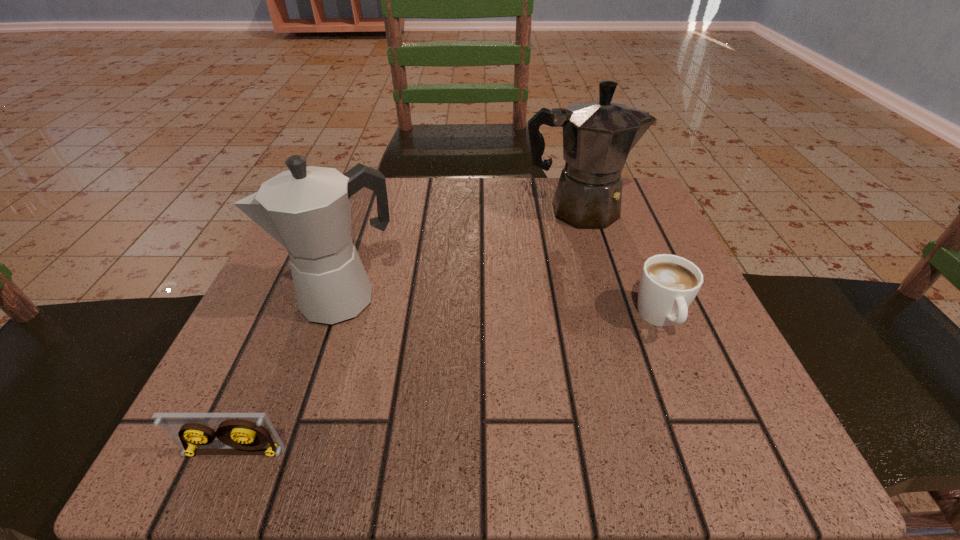
Where is `the farther coffeepot`? The width and height of the screenshot is (960, 540). the farther coffeepot is located at coordinates (597, 135).

At what (x,y) coordinates should I click in order to perform the action: click on the right coffeepot. Please return your answer as a coordinate pair (x, y). The height and width of the screenshot is (540, 960). Looking at the image, I should click on (597, 135).

Locate an element on the screen. The height and width of the screenshot is (540, 960). the left coffeepot is located at coordinates (307, 210).

Find the location of a particular element. cappuccino is located at coordinates (668, 285).

Identify the location of videotape. The width and height of the screenshot is (960, 540). (239, 433).

Locate an element on the screen. The width and height of the screenshot is (960, 540). free location located 0.300m on the right of the left coffeepot is located at coordinates tap(576, 300).

Locate an element on the screen. free location located 0.140m with the handle on the side of the cappuccino is located at coordinates (707, 430).

This screenshot has height=540, width=960. What are the coordinates of `object present at the far edge` in the screenshot? It's located at (597, 135).

The height and width of the screenshot is (540, 960). What are the coordinates of `object situated at the near edge` in the screenshot? It's located at (239, 433).

I want to click on coffeepot situated at the left edge, so click(x=307, y=210).